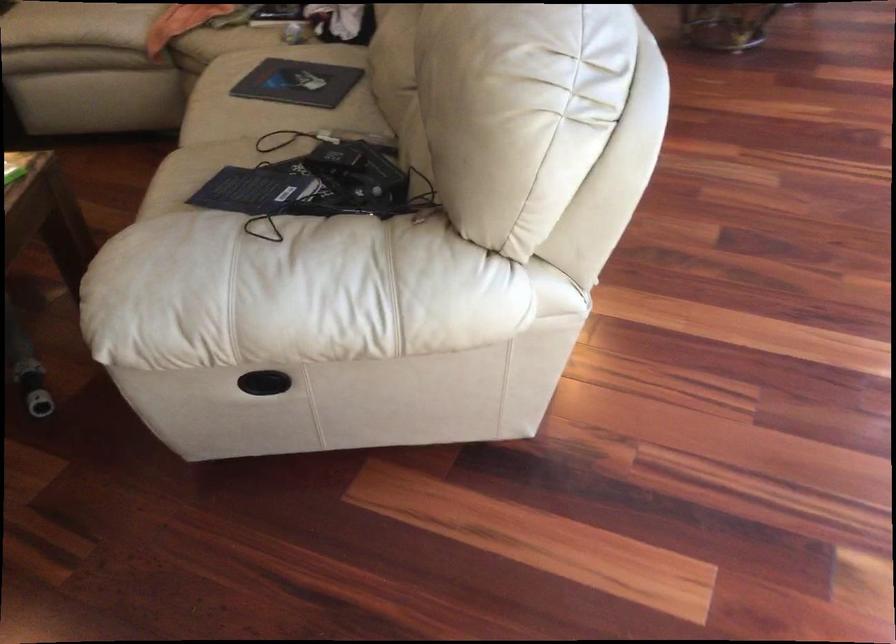
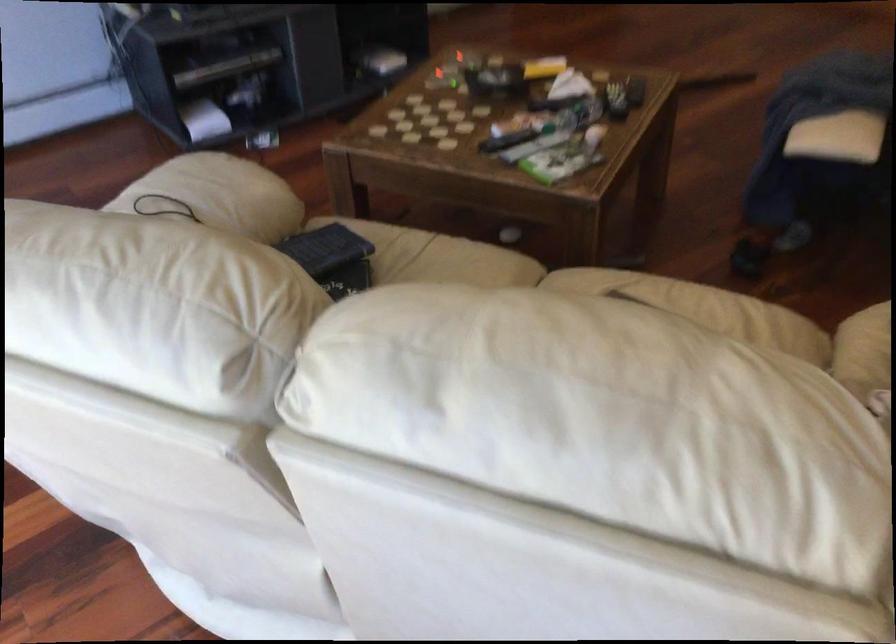
Where in the second image is the point corresponding to [254,178] from the first image?

(325, 249)